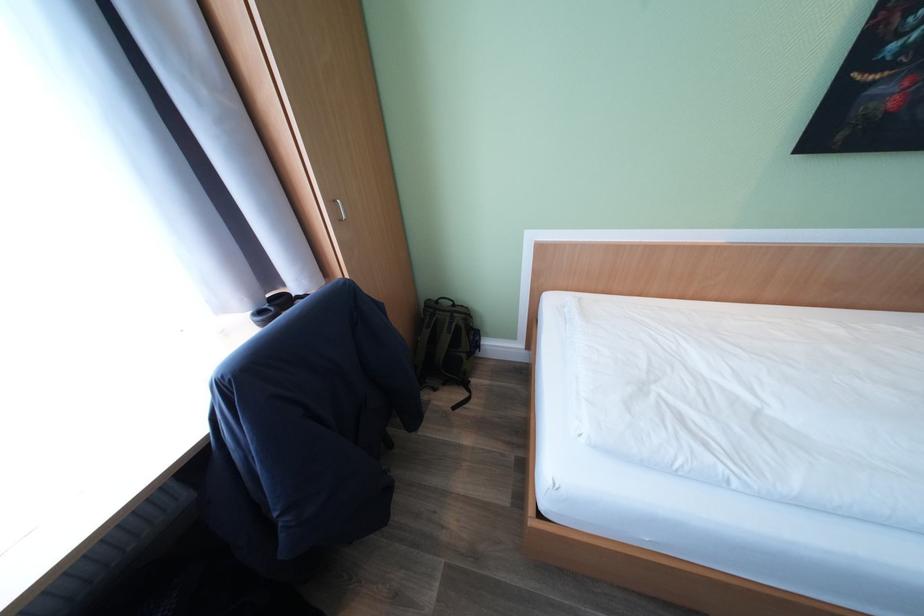
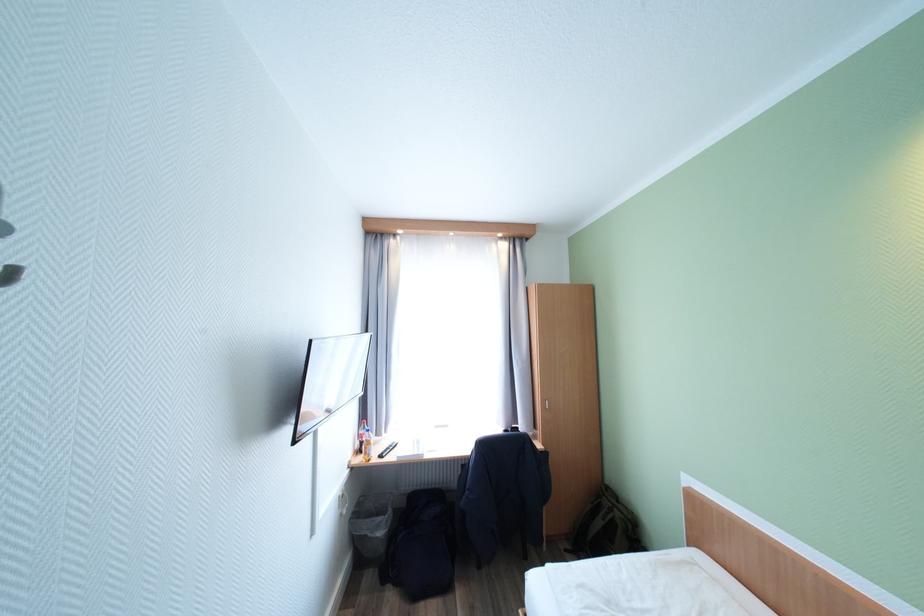
Locate, in the second image, the point that corresponds to the point at 342,201 in the first image.

(553, 402)